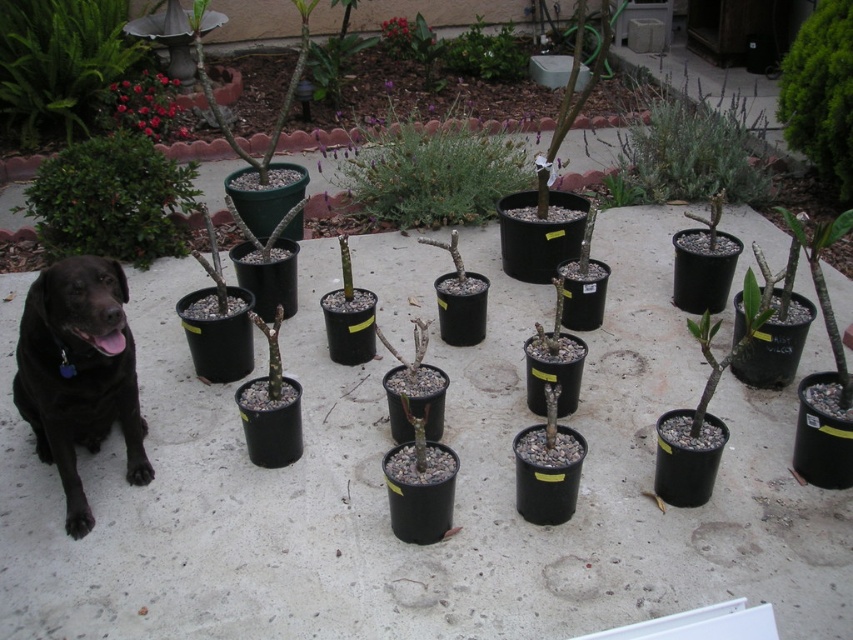
Does green matte bush at upper left have a lesser height compared to green matte plant at upper center?

No, green matte bush at upper left is not shorter than green matte plant at upper center.

How far apart are green matte bush at upper left and green matte plant at upper center?

3.80 meters

Where is `green matte bush at upper left`? The width and height of the screenshot is (853, 640). green matte bush at upper left is located at coordinates (111, 200).

Who is higher up, black matte dog at lower left or green matte bush at upper left?

green matte bush at upper left

Can you confirm if black matte dog at lower left is shorter than green matte bush at upper left?

Yes.

The width and height of the screenshot is (853, 640). What do you see at coordinates (78, 372) in the screenshot? I see `black matte dog at lower left` at bounding box center [78, 372].

Where is `black matte dog at lower left`? This screenshot has width=853, height=640. black matte dog at lower left is located at coordinates [x=78, y=372].

Locate an element on the screen. green matte bush at upper left is located at coordinates (111, 200).

Is point (138, 248) more distant than point (157, 125)?

No, (138, 248) is closer to viewer.

What do you see at coordinates (111, 200) in the screenshot?
I see `green matte bush at upper left` at bounding box center [111, 200].

Identify the location of green matte bush at upper left. (111, 200).